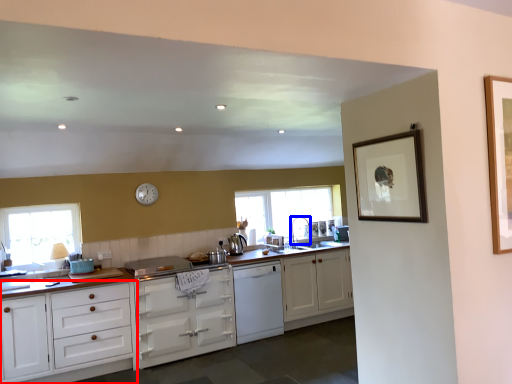
Question: Which point is further to the camera, cabinetry (highlighted by a red box) or faucet (highlighted by a blue box)?

Choices:
 (A) cabinetry
 (B) faucet

Answer: (B)